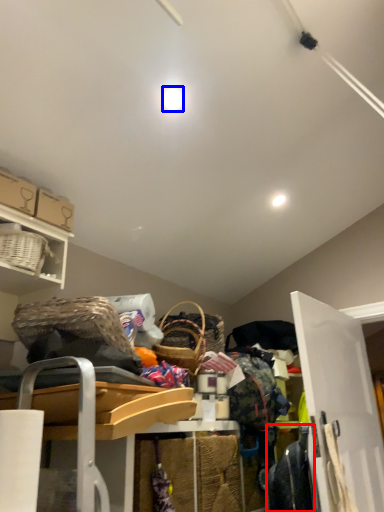
Question: Which point is further to the camera, clothing (highlighted by a red box) or light (highlighted by a blue box)?

Choices:
 (A) clothing
 (B) light

Answer: (A)